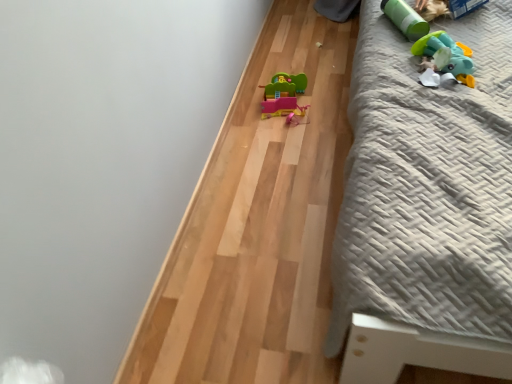
Question: Considering the relative sizes of matte plastic toy car at center, which appears as the first toy when viewed from the left, and rubber duck at upper right, the third toy positioned from the left, in the image provided, is matte plastic toy car at center, which appears as the first toy when viewed from the left, smaller than rubber duck at upper right, the third toy positioned from the left,?

Choices:
 (A) yes
 (B) no

Answer: (B)

Question: Is matte plastic toy car at center, arranged as the third toy when viewed from the right, far from rubber duck at upper right, the third toy positioned from the left?

Choices:
 (A) yes
 (B) no

Answer: (B)

Question: Is matte plastic toy car at center, arranged as the third toy when viewed from the right, positioned in front of rubber duck at upper right, which ranks as the 1th toy in right-to-left order?

Choices:
 (A) yes
 (B) no

Answer: (B)

Question: Can you confirm if matte plastic toy car at center, which appears as the first toy when viewed from the left, is bigger than rubber duck at upper right, which ranks as the 1th toy in right-to-left order?

Choices:
 (A) no
 (B) yes

Answer: (B)

Question: Considering the relative sizes of matte plastic toy car at center, the third toy from the front, and rubber duck at upper right, the third toy positioned from the left, in the image provided, is matte plastic toy car at center, the third toy from the front, shorter than rubber duck at upper right, the third toy positioned from the left,?

Choices:
 (A) yes
 (B) no

Answer: (B)

Question: From a real-world perspective, is gray textured bed at right physically located above or below matte plastic toy car at center, arranged as the third toy when viewed from the right?

Choices:
 (A) above
 (B) below

Answer: (A)

Question: From the image's perspective, is gray textured bed at right positioned above or below matte plastic toy car at center, which appears as the first toy when viewed from the left?

Choices:
 (A) above
 (B) below

Answer: (A)

Question: Is gray textured bed at right bigger or smaller than matte plastic toy car at center, arranged as the third toy when viewed from the right?

Choices:
 (A) small
 (B) big

Answer: (B)

Question: Is gray textured bed at right in front of or behind matte plastic toy car at center, which is the 1th toy in back-to-front order, in the image?

Choices:
 (A) behind
 (B) front

Answer: (B)

Question: Is matte plastic toy car at center, the third toy from the front, situated inside gray textured bed at right or outside?

Choices:
 (A) inside
 (B) outside

Answer: (B)

Question: From a real-world perspective, is matte plastic toy car at center, which appears as the first toy when viewed from the left, physically located above or below gray textured bed at right?

Choices:
 (A) above
 (B) below

Answer: (B)

Question: Looking at the image, does matte plastic toy car at center, which is the 1th toy in back-to-front order, seem bigger or smaller compared to gray textured bed at right?

Choices:
 (A) small
 (B) big

Answer: (A)

Question: Relative to gray textured bed at right, is matte plastic toy car at center, arranged as the third toy when viewed from the right, in front or behind?

Choices:
 (A) behind
 (B) front

Answer: (A)

Question: Considering the positions of matte plastic toy car at center, the third toy from the front, and green matte cylinder at upper right, the second toy in the front-to-back sequence, in the image, is matte plastic toy car at center, the third toy from the front, wider or thinner than green matte cylinder at upper right, the second toy in the front-to-back sequence,?

Choices:
 (A) wide
 (B) thin

Answer: (B)

Question: Considering the positions of matte plastic toy car at center, which is the 1th toy in back-to-front order, and green matte cylinder at upper right, the second toy in the front-to-back sequence, in the image, is matte plastic toy car at center, which is the 1th toy in back-to-front order, taller or shorter than green matte cylinder at upper right, the second toy in the front-to-back sequence,?

Choices:
 (A) tall
 (B) short

Answer: (A)